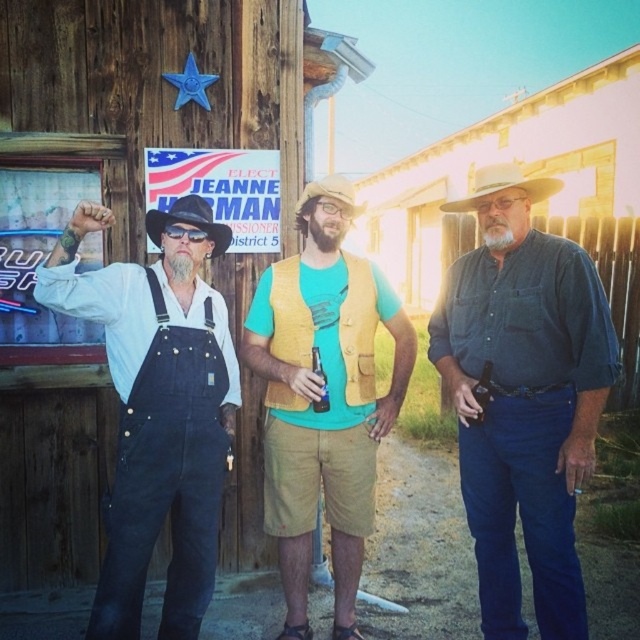
You are a photographer trying to capture a group photo of the three people. You need to ensure that the denim shirt at center and the brown felt cowboy hat at center are both visible in the frame. Based on their sizes, which object should you focus on to ensure both are in the frame?

The denim shirt at center is taller than the brown felt cowboy hat at center, so focusing on the denim shirt at center will ensure both are visible since it is the taller object.

Based on the scene description, which of the two individuals is taller? The one wearing denim overalls at left or the one in yellow textured vest at center?

The yellow textured vest at center is taller than denim overalls at left according to the description.

You are a photographer trying to capture both the white felt cowboy hat at center and the black felt cowboy hat at left in a single frame. Considering their positions and sizes, which hat would appear larger in the photo?

The white felt cowboy hat at center might appear larger in the photo because it is wider than the black felt cowboy hat at left.